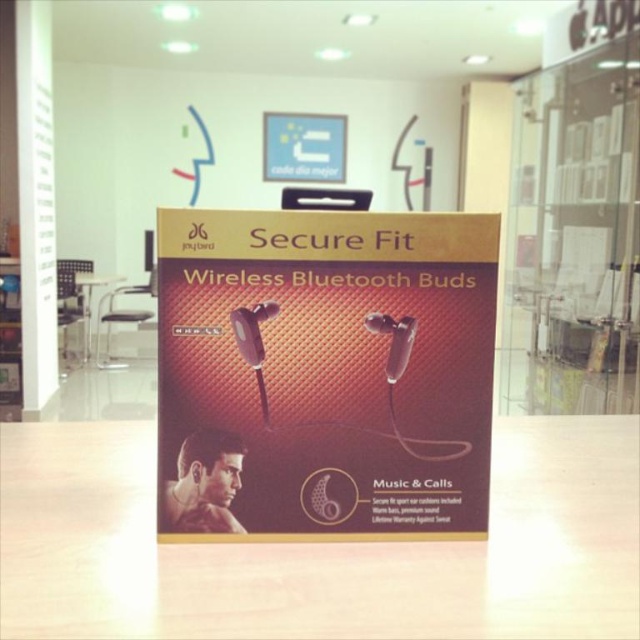
You are standing 1 meter away from the product display for Secure Fit Wireless Bluetooth Buds by Joybird. There is a point at coordinates point (x=115, y=502) on the packaging. Can you reach this point without moving closer than 1 meter?

The distance of point (x=115, y=502) from the viewer is 50.02 centimeters. Since you are standing 1 meter away, which is farther than 50.02 cm, you cannot reach the point without moving closer than 1 meter.

Where is the satin silver microphone at center located on the product display box?

The satin silver microphone at center is located at point (253, 342) on the product display box.

You are setting up a product display for a new gadget. You have a wooden table at center and a clear plastic microphone at center. Which object will occupy more space on the display?

The wooden table at center has a larger size compared to the clear plastic microphone at center, so it will occupy more space on the display.